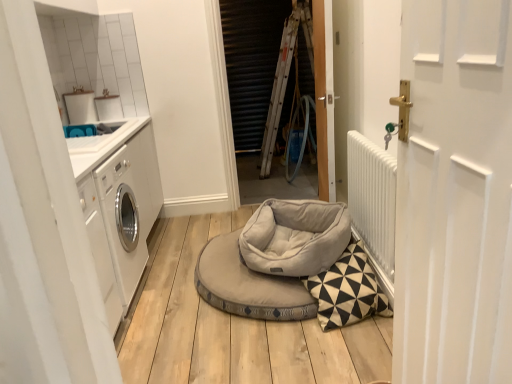
Question: From a real-world perspective, is wooden door at center, the first door from the back, located higher than white textured radiator at right?

Choices:
 (A) no
 (B) yes

Answer: (B)

Question: Considering the relative sizes of wooden door at center, placed as the 2th door when sorted from front to back, and white textured radiator at right in the image provided, is wooden door at center, placed as the 2th door when sorted from front to back, bigger than white textured radiator at right?

Choices:
 (A) no
 (B) yes

Answer: (B)

Question: Is wooden door at center, placed as the 2th door when sorted from front to back, not close to white textured radiator at right?

Choices:
 (A) yes
 (B) no

Answer: (B)

Question: Is wooden door at center, placed as the 2th door when sorted from front to back, next to white textured radiator at right?

Choices:
 (A) no
 (B) yes

Answer: (A)

Question: Does wooden door at center, placed as the 2th door when sorted from front to back, come in front of white textured radiator at right?

Choices:
 (A) yes
 (B) no

Answer: (B)

Question: Is light gray plush dog bed at center, which ranks as the 1th dog bed in top-to-bottom order, to the left or to the right of white matte door at right, acting as the 1th door starting from the front, in the image?

Choices:
 (A) left
 (B) right

Answer: (A)

Question: In terms of size, does light gray plush dog bed at center, which ranks as the 1th dog bed in top-to-bottom order, appear bigger or smaller than white matte door at right, positioned as the 2th door in back-to-front order?

Choices:
 (A) big
 (B) small

Answer: (B)

Question: Is point (309, 221) closer or farther from the camera than point (446, 288)?

Choices:
 (A) closer
 (B) farther

Answer: (B)

Question: In terms of height, does light gray plush dog bed at center, which ranks as the 1th dog bed in top-to-bottom order, look taller or shorter compared to white matte door at right, acting as the 1th door starting from the front?

Choices:
 (A) tall
 (B) short

Answer: (B)

Question: Based on their positions, is metallic silver screen door at center located to the left or right of wooden door at center, placed as the 2th door when sorted from front to back?

Choices:
 (A) right
 (B) left

Answer: (B)

Question: Considering the positions of point (284, 26) and point (325, 175), is point (284, 26) closer or farther from the camera than point (325, 175)?

Choices:
 (A) farther
 (B) closer

Answer: (A)

Question: From the image's perspective, is metallic silver screen door at center above or below wooden door at center, placed as the 2th door when sorted from front to back?

Choices:
 (A) above
 (B) below

Answer: (A)

Question: Looking at their shapes, would you say metallic silver screen door at center is wider or thinner than wooden door at center, placed as the 2th door when sorted from front to back?

Choices:
 (A) wide
 (B) thin

Answer: (A)

Question: From their relative heights in the image, would you say light gray fabric dog bed at center, the second dog bed when ordered from top to bottom, is taller or shorter than white matte door at right, acting as the 1th door starting from the front?

Choices:
 (A) tall
 (B) short

Answer: (B)

Question: Considering their positions, is light gray fabric dog bed at center, the second dog bed when ordered from top to bottom, located in front of or behind white matte door at right, acting as the 1th door starting from the front?

Choices:
 (A) front
 (B) behind

Answer: (B)